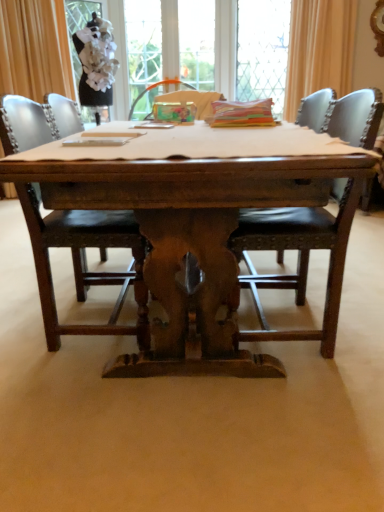
Question: Should I look upward or downward to see clear glass window screen at upper center?

Choices:
 (A) up
 (B) down

Answer: (A)

Question: From the image's perspective, is matte gold curtain at upper left, positioned as the 1th curtain in left-to-right order, below wooden table at center?

Choices:
 (A) no
 (B) yes

Answer: (A)

Question: Considering the relative sizes of matte gold curtain at upper left, positioned as the 1th curtain in left-to-right order, and wooden table at center in the image provided, is matte gold curtain at upper left, positioned as the 1th curtain in left-to-right order, wider than wooden table at center?

Choices:
 (A) no
 (B) yes

Answer: (A)

Question: Is matte gold curtain at upper left, which ranks as the second curtain in right-to-left order, further to the viewer compared to wooden table at center?

Choices:
 (A) yes
 (B) no

Answer: (A)

Question: Is matte gold curtain at upper left, positioned as the 1th curtain in left-to-right order, to the left of wooden table at center from the viewer's perspective?

Choices:
 (A) no
 (B) yes

Answer: (B)

Question: From a real-world perspective, is matte gold curtain at upper left, positioned as the 1th curtain in left-to-right order, positioned under wooden table at center based on gravity?

Choices:
 (A) no
 (B) yes

Answer: (A)

Question: Is matte gold curtain at upper left, which ranks as the second curtain in right-to-left order, outside of wooden table at center?

Choices:
 (A) yes
 (B) no

Answer: (A)

Question: Is white fabric screen door at upper left far away from orange fabric curtain at upper right, the second curtain positioned from the left?

Choices:
 (A) yes
 (B) no

Answer: (A)

Question: Does white fabric screen door at upper left appear on the right side of orange fabric curtain at upper right, placed as the 1th curtain when sorted from right to left?

Choices:
 (A) no
 (B) yes

Answer: (A)

Question: Are white fabric screen door at upper left and orange fabric curtain at upper right, the second curtain positioned from the left, beside each other?

Choices:
 (A) yes
 (B) no

Answer: (B)

Question: From a real-world perspective, is white fabric screen door at upper left positioned under orange fabric curtain at upper right, placed as the 1th curtain when sorted from right to left, based on gravity?

Choices:
 (A) yes
 (B) no

Answer: (A)

Question: Would you say white fabric screen door at upper left is outside orange fabric curtain at upper right, placed as the 1th curtain when sorted from right to left?

Choices:
 (A) yes
 (B) no

Answer: (A)

Question: Can you confirm if white fabric screen door at upper left is wider than orange fabric curtain at upper right, the second curtain positioned from the left?

Choices:
 (A) yes
 (B) no

Answer: (B)

Question: Is smooth wooden table at center facing away from white fabric screen door at upper left?

Choices:
 (A) yes
 (B) no

Answer: (B)